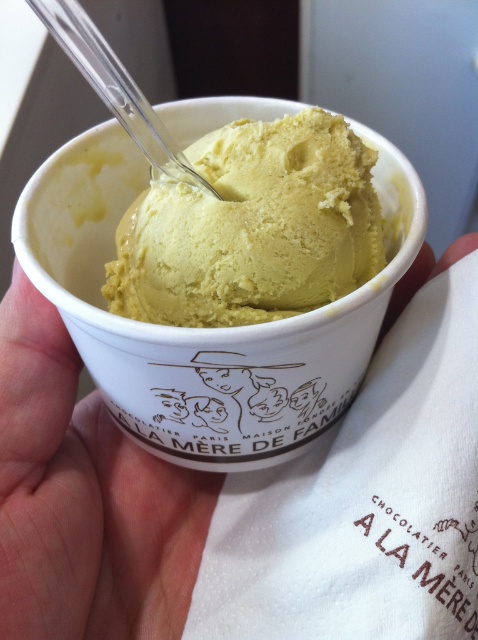
Question: Among these objects, which one is nearest to the camera?

Choices:
 (A) smooth skin at center
 (B) yellow matte ice cream at center
 (C) transparent plastic spoon at upper center

Answer: (C)

Question: Does yellow matte ice cream at center appear under transparent plastic spoon at upper center?

Choices:
 (A) yes
 (B) no

Answer: (A)

Question: Which object is farther from the camera taking this photo?

Choices:
 (A) smooth skin at center
 (B) yellow matte ice cream at center
 (C) transparent plastic spoon at upper center

Answer: (B)

Question: Which point is farther from the camera taking this photo?

Choices:
 (A) (269, 282)
 (B) (50, 586)

Answer: (A)

Question: Can you confirm if smooth skin at center is positioned below yellow matte ice cream at center?

Choices:
 (A) no
 (B) yes

Answer: (B)

Question: Does smooth skin at center have a greater width compared to yellow matte ice cream at center?

Choices:
 (A) yes
 (B) no

Answer: (B)